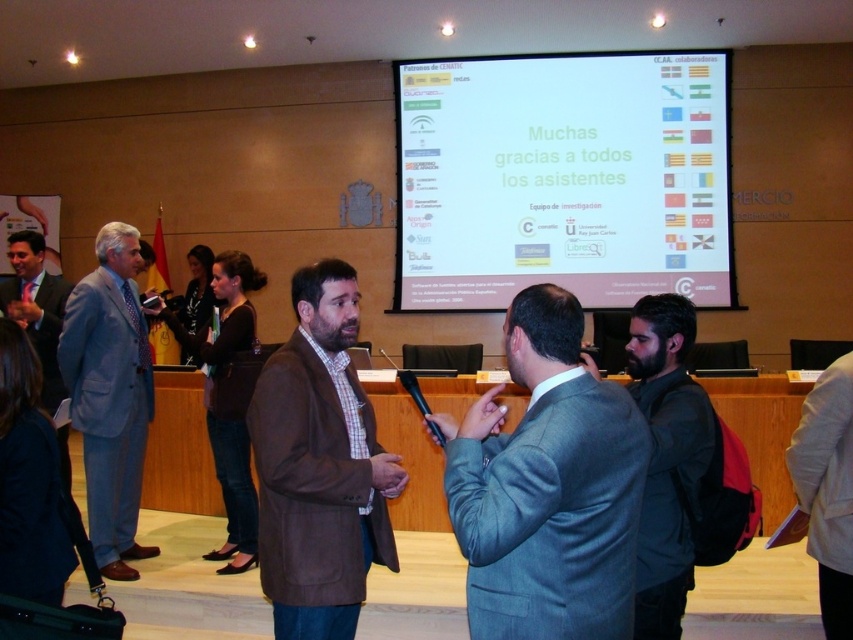
Question: Which point is closer to the camera?

Choices:
 (A) gray fabric jacket at lower right
 (B) black matte jacket at lower right
 (C) white matte projection screen at upper center

Answer: (B)

Question: Is white matte projection screen at upper center to the right of light gray suit at left from the viewer's perspective?

Choices:
 (A) no
 (B) yes

Answer: (B)

Question: Which of the following is the farthest from the observer?

Choices:
 (A) (96, 301)
 (B) (332, 324)
 (C) (585, 280)
 (D) (485, 614)

Answer: (C)

Question: Which object is positioned farthest from the matte black suit at left?

Choices:
 (A) brown woolen jacket at center
 (B) gray fabric jacket at lower right
 (C) gray suit at center
 (D) white matte projection screen at upper center

Answer: (D)

Question: Can you confirm if white matte projection screen at upper center is thinner than gray suit at center?

Choices:
 (A) no
 (B) yes

Answer: (A)

Question: Does gray suit at center have a lesser width compared to light gray suit at left?

Choices:
 (A) yes
 (B) no

Answer: (B)